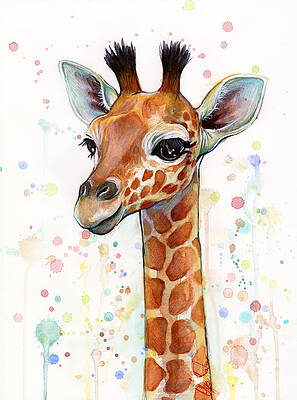
The image size is (297, 400). In order to click on child art in this screenshot , I will do `click(253, 344)`.